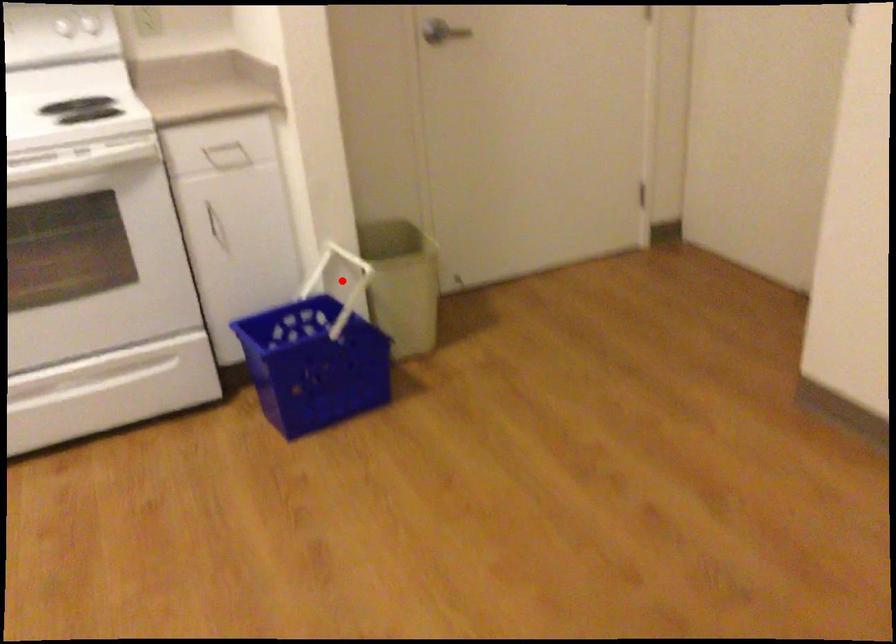
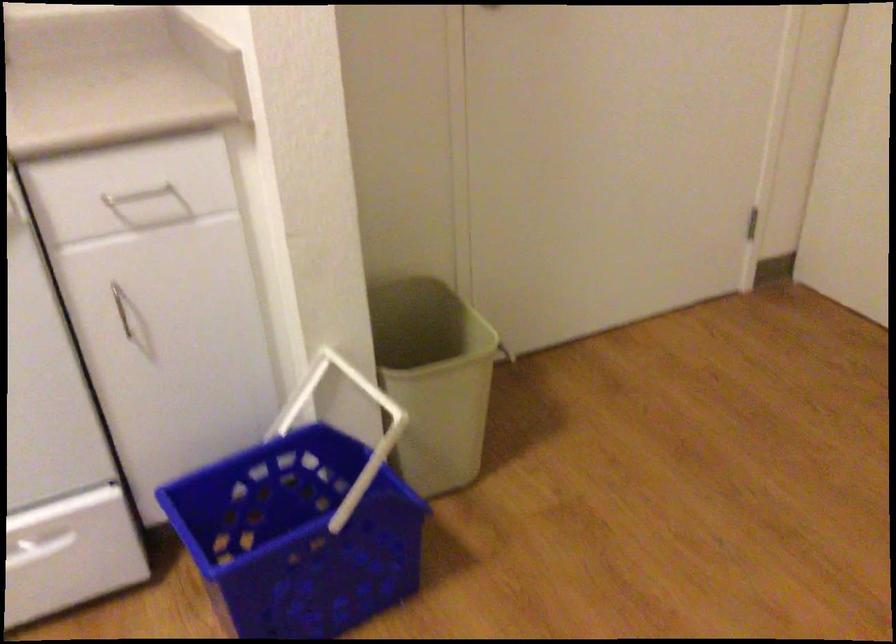
The point at the highlighted location is marked in the first image. Where is the corresponding point in the second image?

(343, 402)